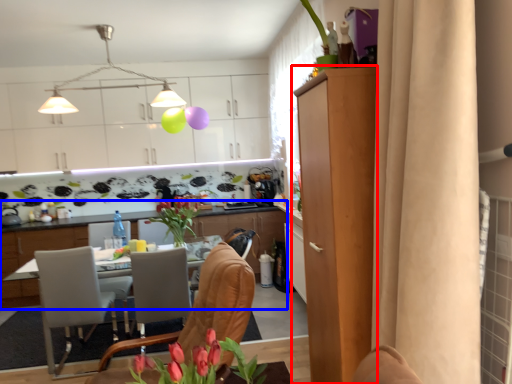
Question: Which of the following is the farthest to the observer, cabinetry (highlighted by a red box) or cabinetry (highlighted by a blue box)?

Choices:
 (A) cabinetry
 (B) cabinetry

Answer: (B)